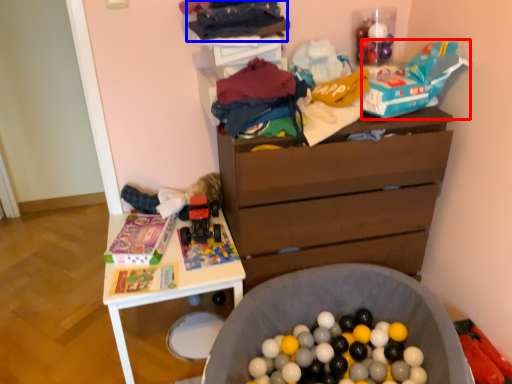
Question: Among these objects, which one is farthest to the camera, toy (highlighted by a red box) or clothing (highlighted by a blue box)?

Choices:
 (A) toy
 (B) clothing

Answer: (A)